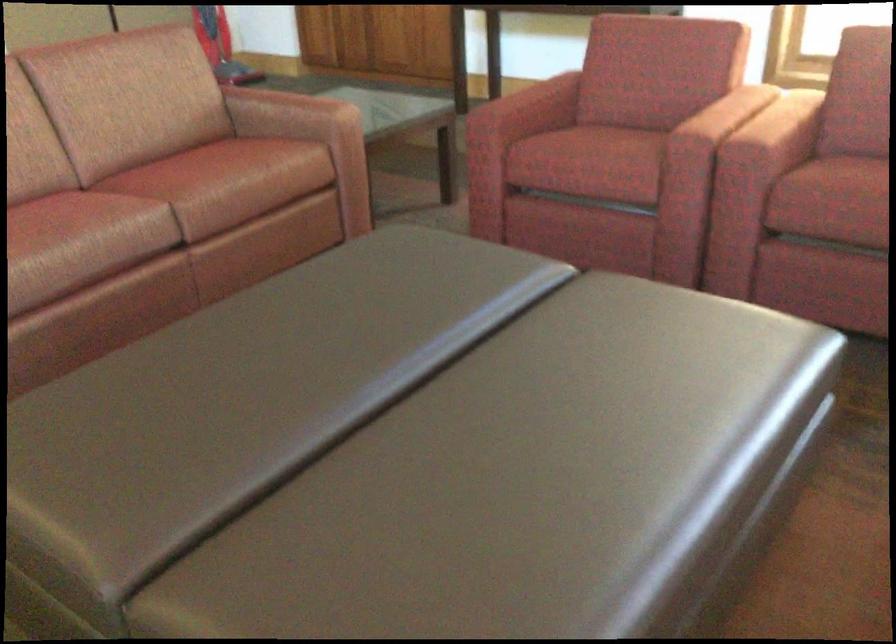
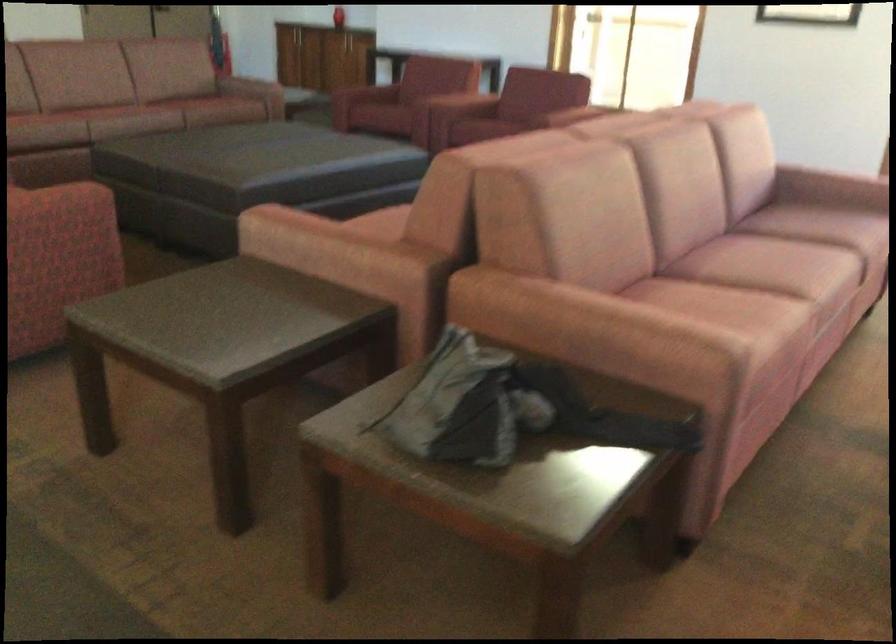
In a continuous first-person perspective shot, in which direction is the camera moving?

The cameraman walked toward right, backward.